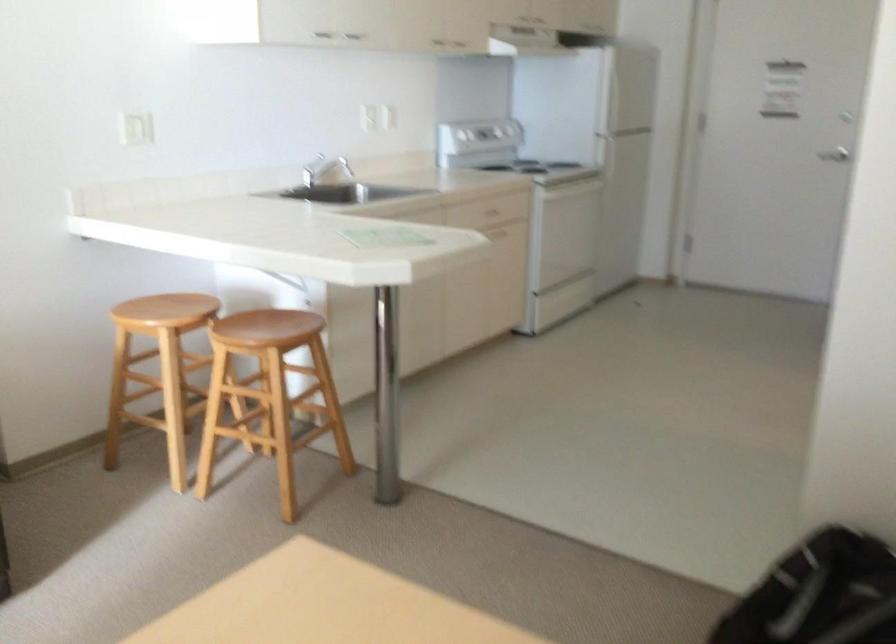
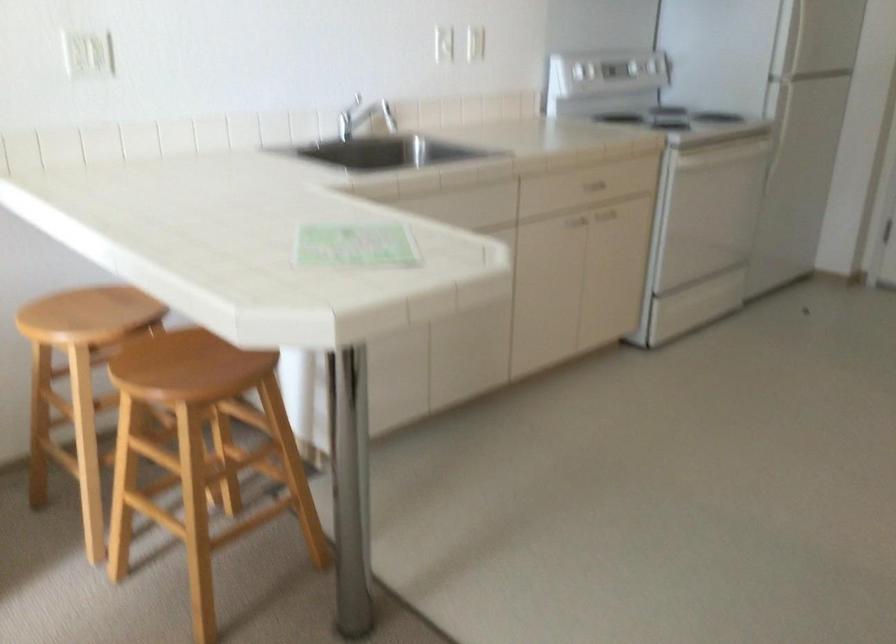
Question: Which direction would the cameraman need to move to produce the second image? Reply with the corresponding letter.

Choices:
 (A) Left
 (B) Right
 (C) Forward
 (D) Backward

Answer: (C)